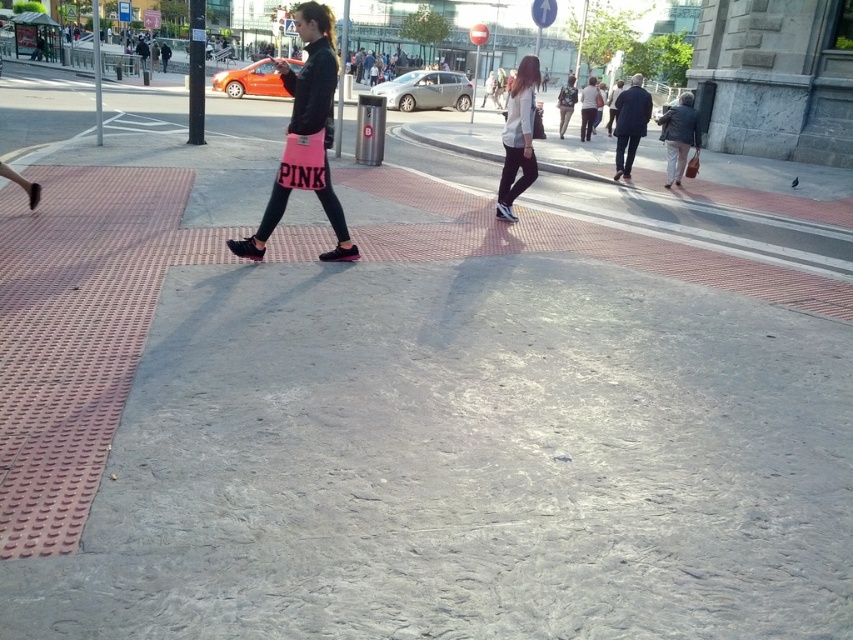
You are a delivery robot positioned at the point labeled as point (x=518, y=138). You need to deliver a package to the person wearing pink shorts with PINK written on them. Based on the scene description, can you determine if the path from your current position to the person is clear of obstacles?

The point (x=518, y=138) is on white matte shirt at center, so the delivery robot is positioned near the person wearing pink shorts with PINK written on them. The path is likely clear since there are no obstacles mentioned between the point and the person in the scene description.